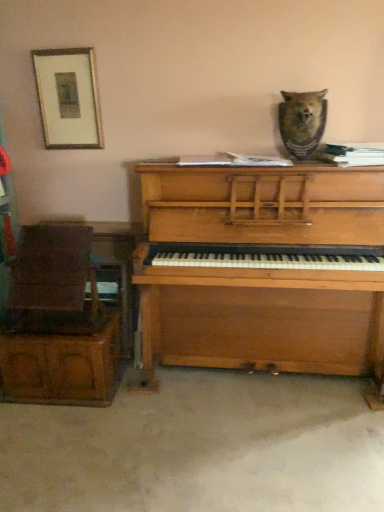
Question: From a real-world perspective, is wooden picture frame at upper left physically below brown fur bear at upper center?

Choices:
 (A) yes
 (B) no

Answer: (B)

Question: Is wooden picture frame at upper left surrounding brown fur bear at upper center?

Choices:
 (A) yes
 (B) no

Answer: (B)

Question: Is wooden picture frame at upper left aimed at brown fur bear at upper center?

Choices:
 (A) yes
 (B) no

Answer: (B)

Question: Would you say wooden picture frame at upper left is a long distance from brown fur bear at upper center?

Choices:
 (A) yes
 (B) no

Answer: (A)

Question: From the image's perspective, does wooden picture frame at upper left appear lower than brown fur bear at upper center?

Choices:
 (A) no
 (B) yes

Answer: (A)

Question: From the image's perspective, is wooden chair at left located above or below brown fur bear at upper center?

Choices:
 (A) above
 (B) below

Answer: (B)

Question: Is wooden chair at left situated inside brown fur bear at upper center or outside?

Choices:
 (A) outside
 (B) inside

Answer: (A)

Question: In terms of height, does wooden chair at left look taller or shorter compared to brown fur bear at upper center?

Choices:
 (A) tall
 (B) short

Answer: (A)

Question: Does point (29, 290) appear closer or farther from the camera than point (291, 126)?

Choices:
 (A) closer
 (B) farther

Answer: (B)

Question: From the image's perspective, is brown fur bear at upper center above or below wooden chair at left?

Choices:
 (A) above
 (B) below

Answer: (A)

Question: Is brown fur bear at upper center inside or outside of wooden chair at left?

Choices:
 (A) inside
 (B) outside

Answer: (B)

Question: Is brown fur bear at upper center bigger or smaller than wooden chair at left?

Choices:
 (A) big
 (B) small

Answer: (B)

Question: In the image, is brown fur bear at upper center on the left side or the right side of wooden chair at left?

Choices:
 (A) left
 (B) right

Answer: (B)

Question: From a real-world perspective, is wooden chair at left above or below brown fur bear at upper center?

Choices:
 (A) below
 (B) above

Answer: (A)

Question: Is point (122, 338) closer or farther from the camera than point (288, 102)?

Choices:
 (A) farther
 (B) closer

Answer: (A)